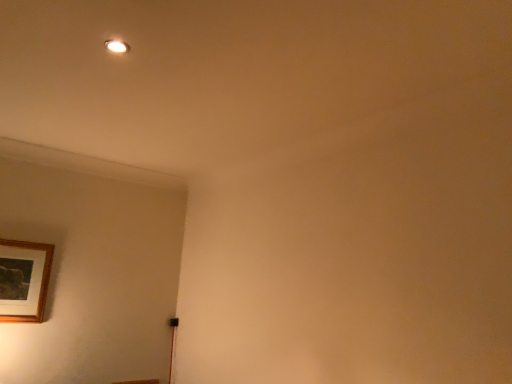
What do you see at coordinates (24, 280) in the screenshot? This screenshot has width=512, height=384. I see `wooden picture frame at lower left` at bounding box center [24, 280].

Where is `wooden picture frame at lower left`? wooden picture frame at lower left is located at coordinates (x=24, y=280).

What are the coordinates of `wooden picture frame at lower left` in the screenshot? It's located at (24, 280).